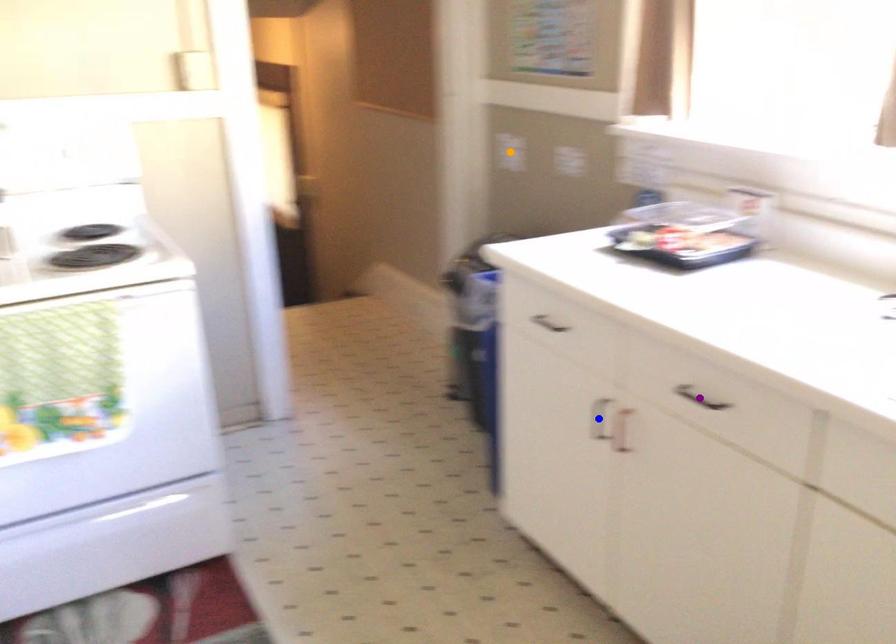
Order these from farthest to nearest:
blue point | orange point | purple point

1. orange point
2. blue point
3. purple point